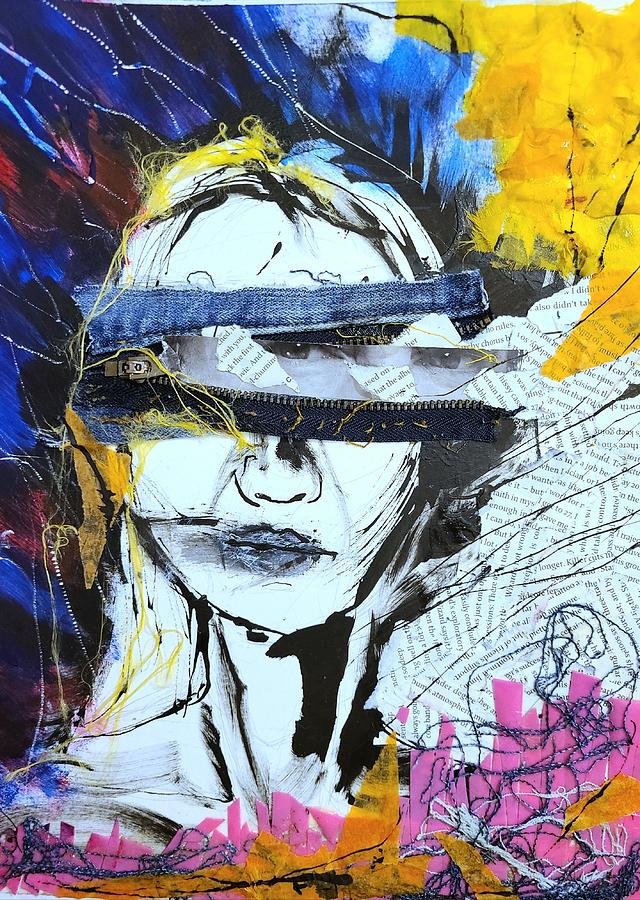
Find the location of a particular element. This screenshot has width=640, height=900. art is located at coordinates (395, 609).